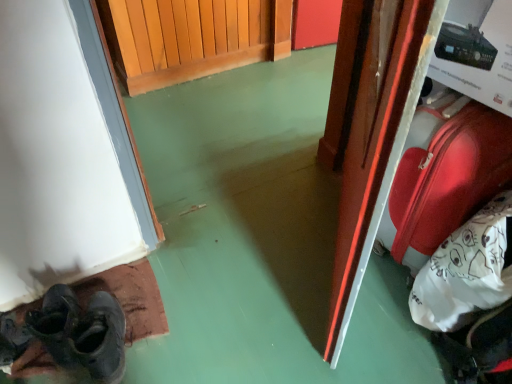
Question: Does point (391, 203) appear closer or farther from the camera than point (390, 153)?

Choices:
 (A) farther
 (B) closer

Answer: (A)

Question: From a real-world perspective, is shiny red suitcase at right positioned above or below glossy wood door at right?

Choices:
 (A) below
 (B) above

Answer: (A)

Question: Which of these objects is positioned closest to the dark gray leather shoe at lower left?

Choices:
 (A) glossy wood door at right
 (B) shiny red suitcase at right
 (C) dark gray leather shoes at lower left

Answer: (C)

Question: Which object is the closest to the shiny red suitcase at right?

Choices:
 (A) dark gray leather shoe at lower left
 (B) glossy wood door at right
 (C) dark gray leather shoes at lower left

Answer: (B)